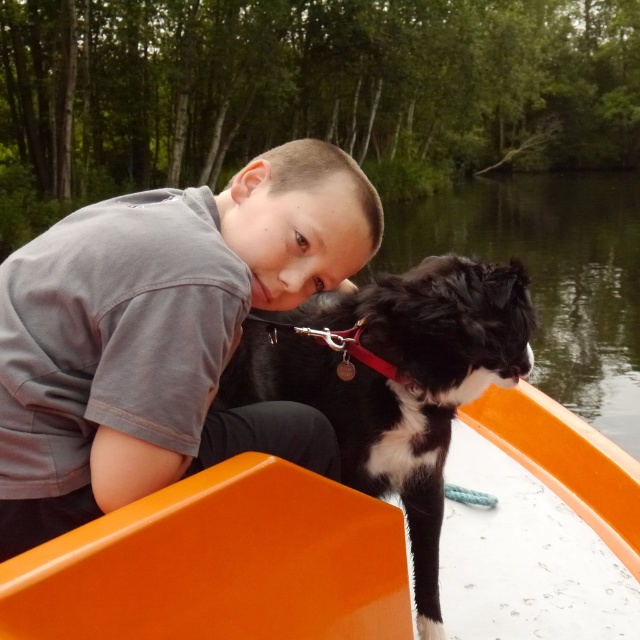
You are a photographer trying to capture a photo of the orange plastic boat at center and the black and white fur dog at center. Since the boat is shorter than the dog, how should you adjust your camera angle to ensure both are fully visible in the frame?

Since the orange plastic boat at center is shorter than the black and white fur dog at center, you should lower your camera angle slightly to ensure the taller dog is fully visible while still capturing the boat in the frame.

In the scene shown: You are a photographer trying to capture the scene of the boy and his dog on the boat. You notice the gray cotton shirt at upper left. Where exactly is the gray cotton shirt positioned in the image?

The gray cotton shirt at upper left is located at point coordinates of 0.522 on the x axis and 0.253 on the y axis.

You are a photographer trying to capture a closeup of the gray cotton shirt at upper left and the black and white fur dog at center. Since you want both subjects to be in focus, which one should you adjust your camera focus on first?

The gray cotton shirt at upper left occupies less space than the black and white fur dog at center, so you should focus on the black and white fur dog at center first to ensure both are in focus.